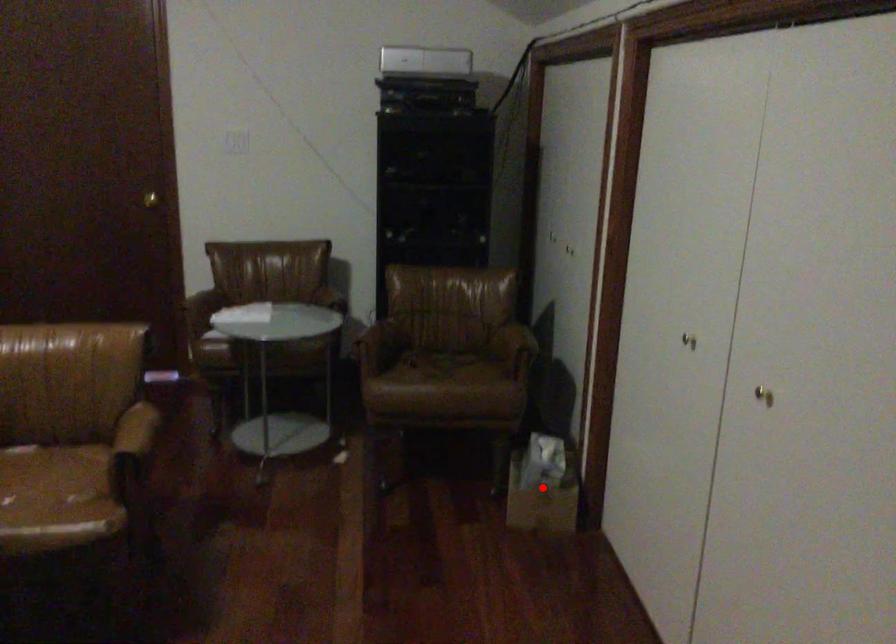
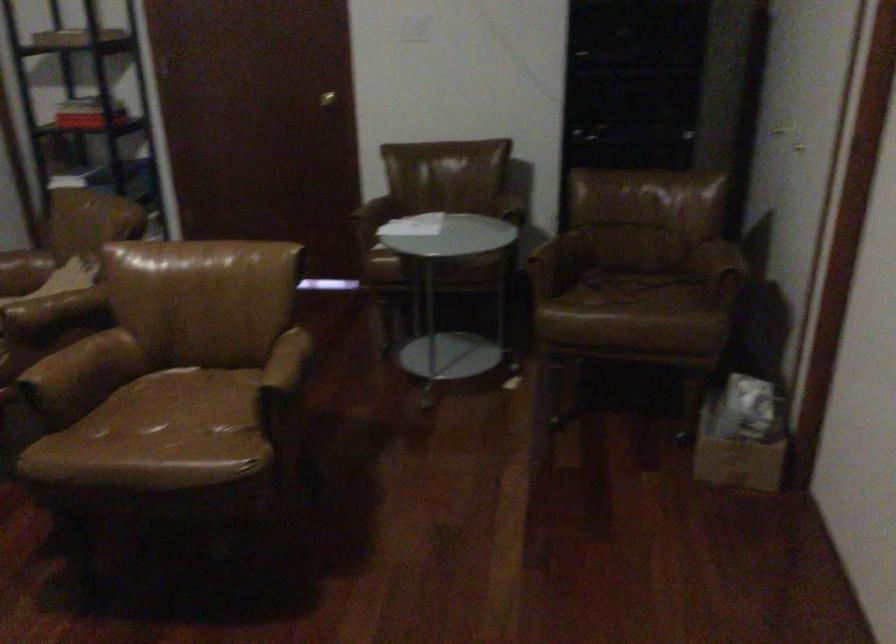
In the second image, find the point that corresponds to the highlighted location in the first image.

(742, 436)